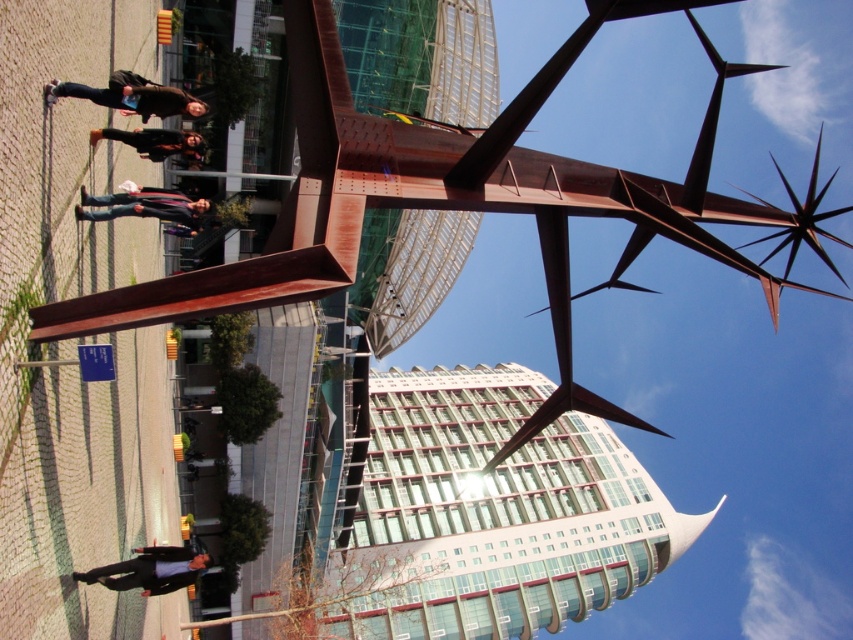
You are standing in the urban scene and want to take a photo of both the dark blue suit at lower left and the matte brown jacket at center. Which one should you adjust your camera focus to first to ensure both are in the frame?

Since the dark blue suit at lower left is closer to the viewer than the matte brown jacket at center, you should focus on the dark blue suit at lower left first to ensure both are in the frame.

You are standing in the urban scene and want to know how far the point at coordinates (x=107, y=97) is from you. Can you determine the distance?

The point at coordinates (x=107, y=97) is 45.56 meters away from the viewer.